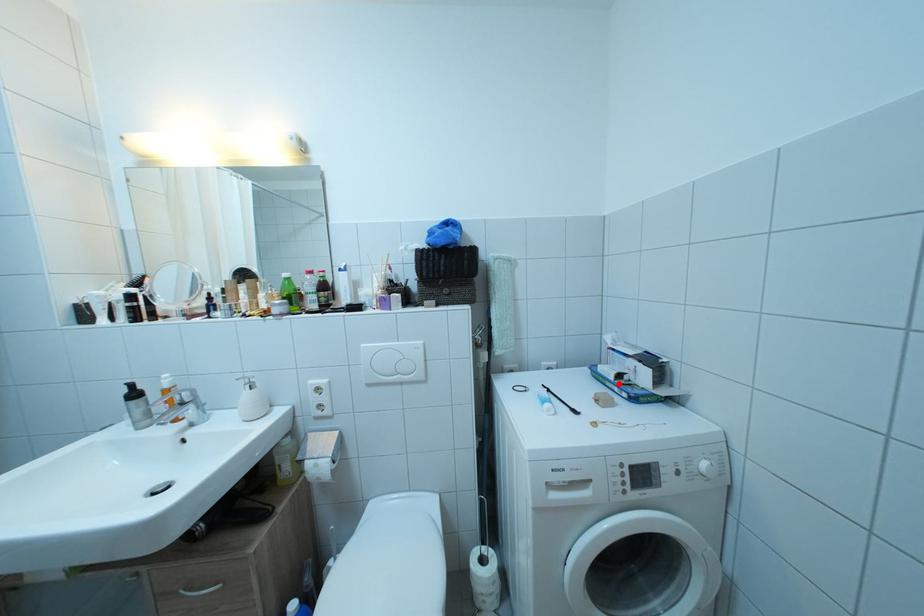
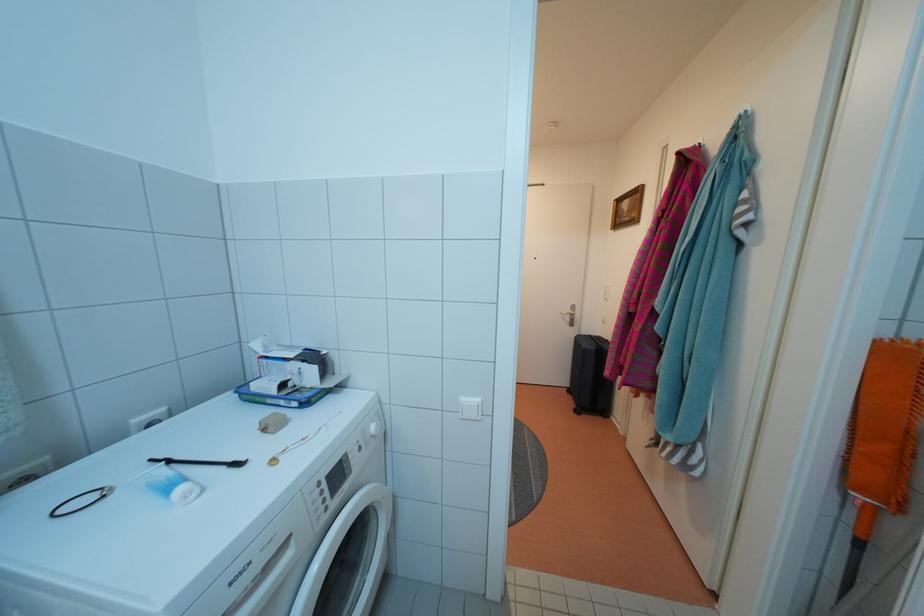
In the second image, find the point that corresponds to the highlighted location in the first image.

(282, 398)